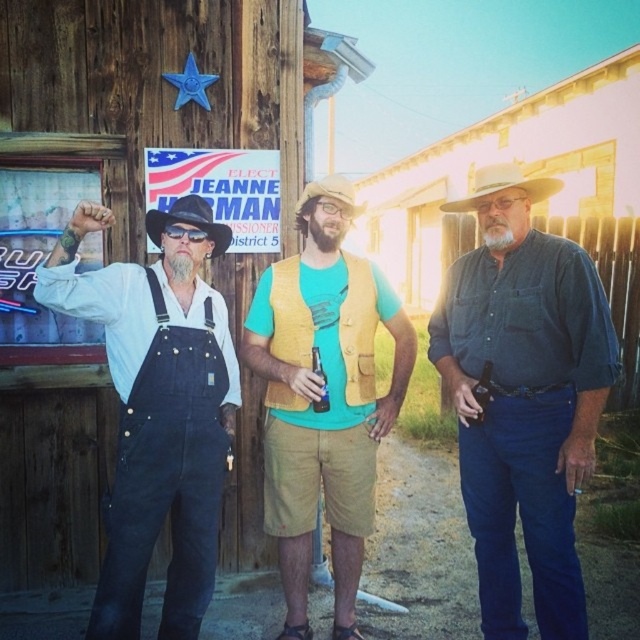
Question: In this image, where is white felt cowboy hat at center located relative to brown felt cowboy hat at center?

Choices:
 (A) left
 (B) right

Answer: (B)

Question: Which object is the closest to the brown felt cowboy hat at center?

Choices:
 (A) denim shirt at center
 (B) black felt cowboy hat at left
 (C) denim overalls at left

Answer: (B)

Question: Does black felt cowboy hat at left have a larger size compared to brown felt cowboy hat at center?

Choices:
 (A) yes
 (B) no

Answer: (B)

Question: From the image, what is the correct spatial relationship of yellow textured vest at center in relation to white felt cowboy hat at center?

Choices:
 (A) right
 (B) left

Answer: (B)

Question: Which of the following is the farthest from the observer?

Choices:
 (A) (342, 371)
 (B) (552, 195)
 (C) (576, 301)

Answer: (A)

Question: Which object appears farthest from the camera in this image?

Choices:
 (A) brown felt cowboy hat at center
 (B) yellow textured vest at center
 (C) black felt cowboy hat at left
 (D) denim shirt at center

Answer: (A)